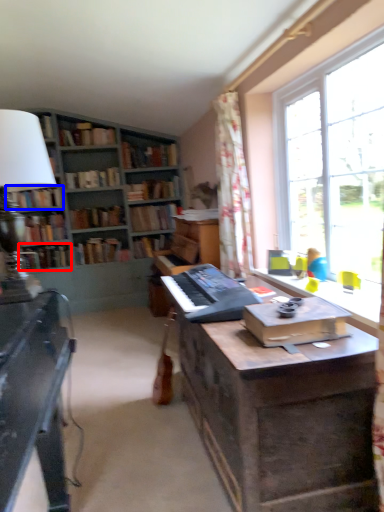
Question: Among these objects, which one is farthest to the camera, book (highlighted by a red box) or book (highlighted by a blue box)?

Choices:
 (A) book
 (B) book

Answer: (A)